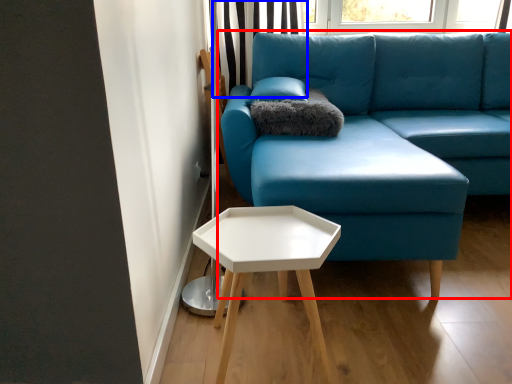
Question: Which point is further to the camera, studio couch (highlighted by a red box) or curtain (highlighted by a blue box)?

Choices:
 (A) studio couch
 (B) curtain

Answer: (B)